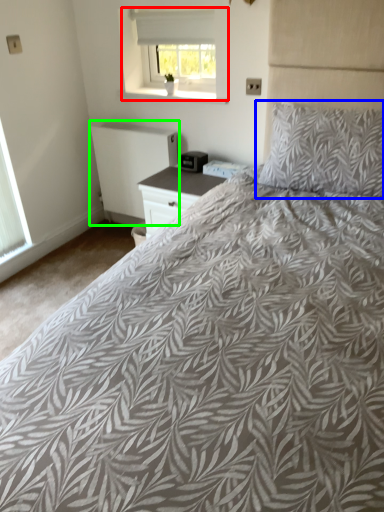
Question: Which object is the farthest from window (highlighted by a red box)? Choose among these: pillow (highlighted by a blue box) or radiator (highlighted by a green box).

Choices:
 (A) pillow
 (B) radiator

Answer: (A)